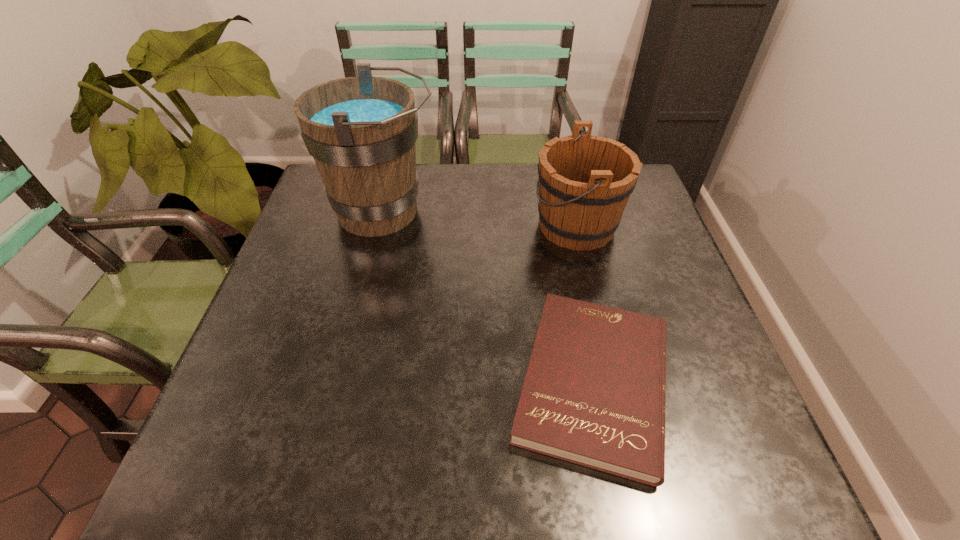
Where is `vacant space situated on the left of the nearest object`? vacant space situated on the left of the nearest object is located at coordinates (336, 382).

In order to click on object that is positioned at the near edge in this screenshot , I will do `click(594, 393)`.

This screenshot has height=540, width=960. I want to click on object located at the left edge, so click(x=361, y=131).

Where is `wine bucket at the right edge`? The height and width of the screenshot is (540, 960). wine bucket at the right edge is located at coordinates (585, 181).

The image size is (960, 540). Find the location of `hardback book located in the right edge section of the desktop`. hardback book located in the right edge section of the desktop is located at coordinates (594, 393).

This screenshot has width=960, height=540. What are the coordinates of `object present at the far left corner` in the screenshot? It's located at (361, 131).

Find the location of a particular element. object at the far right corner is located at coordinates (585, 181).

This screenshot has width=960, height=540. I want to click on object positioned at the near right corner, so click(x=594, y=393).

At what (x,y) coordinates should I click in order to perform the action: click on free spot at the far edge of the desktop. Please return your answer as a coordinate pair (x, y). The height and width of the screenshot is (540, 960). Looking at the image, I should click on (516, 210).

The image size is (960, 540). In the image, there is a desktop. Identify the location of vacant space at the near edge. (303, 486).